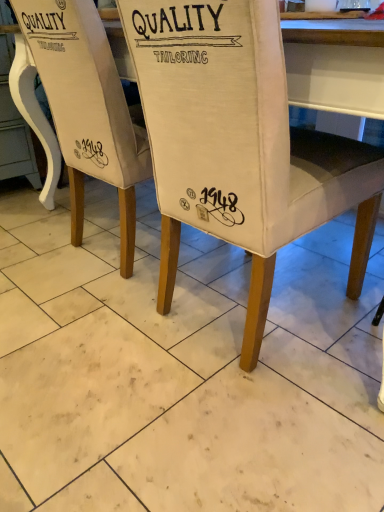
Find the location of a particular element. vacant area that is in front of white fabric chair at center, which is the first chair in right-to-left order is located at coordinates (235, 431).